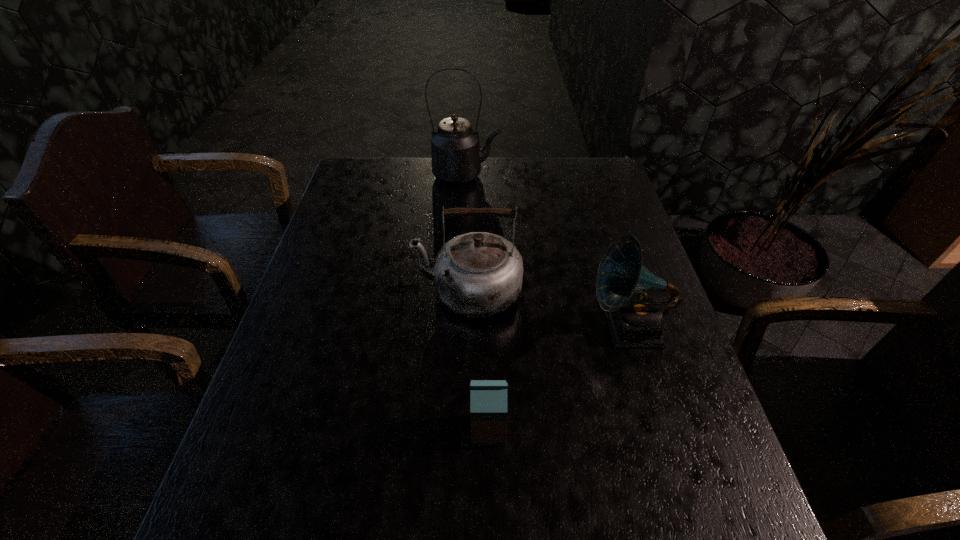
Image resolution: width=960 pixels, height=540 pixels. I want to click on free space located 0.250m from the horn of the phonograph_record, so click(483, 328).

Identify the location of vacant position located from the horn of the phonograph_record. Image resolution: width=960 pixels, height=540 pixels. (564, 328).

In order to click on free region located from the horn of the phonograph_record in this screenshot , I will do `click(525, 328)`.

The height and width of the screenshot is (540, 960). Find the location of `free space located on the back of the shortest object`. free space located on the back of the shortest object is located at coordinates (486, 278).

The width and height of the screenshot is (960, 540). Find the location of `object positioned at the far edge`. object positioned at the far edge is located at coordinates (456, 156).

Image resolution: width=960 pixels, height=540 pixels. I want to click on object positioned at the right edge, so click(x=635, y=320).

The width and height of the screenshot is (960, 540). In the image, there is a desktop. In order to click on blank space at the far edge in this screenshot , I will do `click(414, 186)`.

The width and height of the screenshot is (960, 540). Identify the location of free spot at the near edge of the desktop. (309, 523).

Identify the location of free space at the left edge. The width and height of the screenshot is (960, 540). (295, 388).

This screenshot has height=540, width=960. In the image, there is a desktop. In order to click on free space at the right edge in this screenshot , I will do `click(659, 357)`.